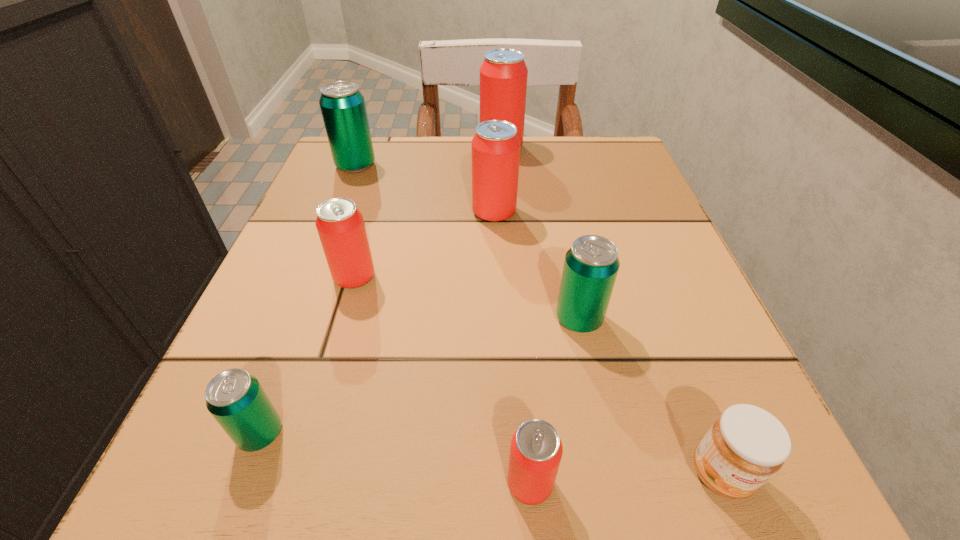
Where is `free space between the fifth nearest object and the tallest object`? The height and width of the screenshot is (540, 960). free space between the fifth nearest object and the tallest object is located at coordinates (428, 212).

Find the location of a particular element. The width and height of the screenshot is (960, 540). empty space between the fourth farthest object and the third farthest beer can is located at coordinates (424, 245).

Locate an element on the screen. The height and width of the screenshot is (540, 960). free space between the smallest red beer can and the farthest teal beer can is located at coordinates (443, 325).

This screenshot has height=540, width=960. I want to click on object that is the sixth closest one to the farthest teal beer can, so click(x=536, y=449).

Identify which object is the closest to the fourth nearest object. Please provide its 2D coordinates. Your answer should be formatted as a tuple, i.e. [(x, y)], where the tuple contains the x and y coordinates of a point satisfying the conditions above.

[(746, 445)]

At what (x,y) coordinates should I click in order to perform the action: click on beer can that is the fourth closest one to the biggest teal beer can. Please return your answer as a coordinate pair (x, y). The width and height of the screenshot is (960, 540). Looking at the image, I should click on (591, 265).

I want to click on beer can that is the third closest to the rightmost object, so click(x=495, y=146).

Choose which red beer can is the fourth nearest neighbor to the jam. Please provide its 2D coordinates. Your answer should be formatted as a tuple, i.e. [(x, y)], where the tuple contains the x and y coordinates of a point satisfying the conditions above.

[(503, 74)]

Identify which red beer can is the nearest to the orange jam. Please provide its 2D coordinates. Your answer should be formatted as a tuple, i.e. [(x, y)], where the tuple contains the x and y coordinates of a point satisfying the conditions above.

[(536, 449)]

Choose which teal beer can is the nearest neighbor to the smallest teal beer can. Please provide its 2D coordinates. Your answer should be formatted as a tuple, i.e. [(x, y)], where the tuple contains the x and y coordinates of a point satisfying the conditions above.

[(591, 265)]